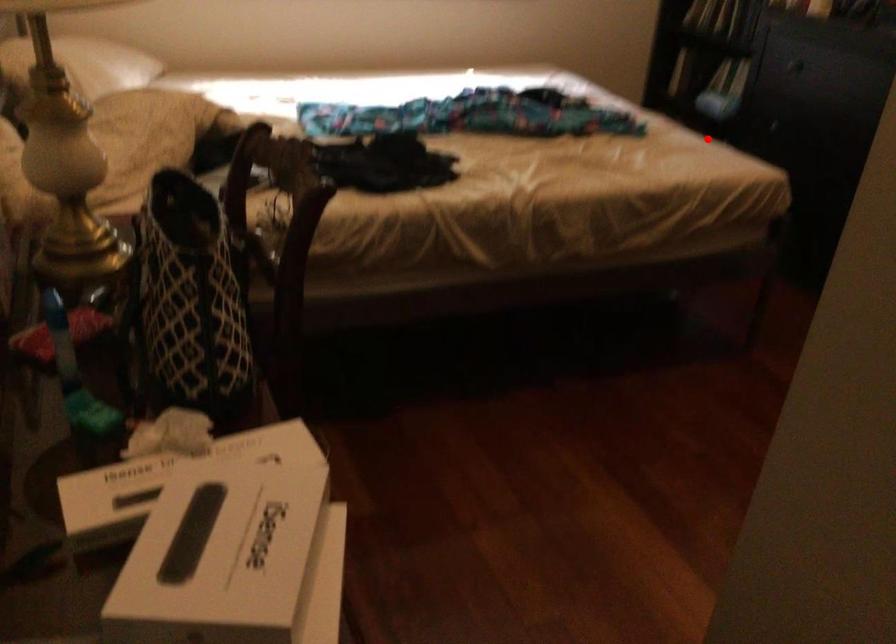
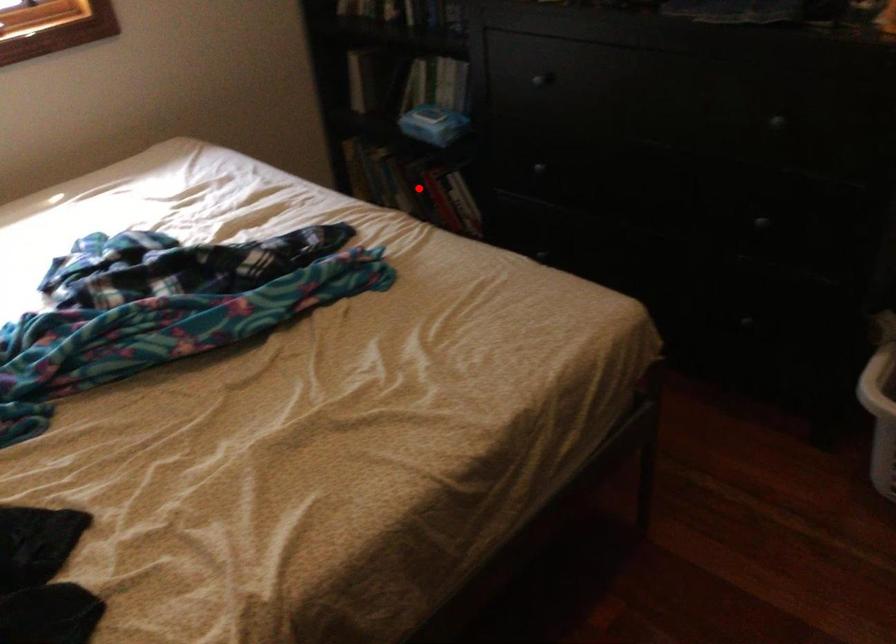
I am providing you with two images of the same scene from different viewpoints. A red point is marked on the first image and another point is marked on the second image. Is the red point in image1 aligned with the point shown in image2?

Yes